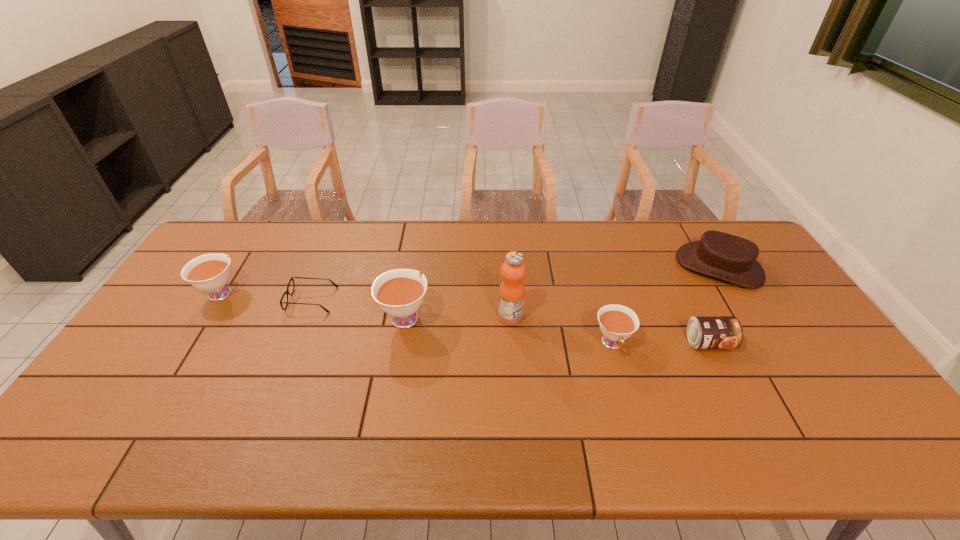
Where is `can`? The height and width of the screenshot is (540, 960). can is located at coordinates (704, 332).

The image size is (960, 540). Find the location of `free space located 0.180m on the side of the leftmost teacup with the handle`. free space located 0.180m on the side of the leftmost teacup with the handle is located at coordinates (252, 242).

I want to click on free location located on the side of the leftmost teacup with the handle, so click(x=261, y=227).

Identify the location of free location located on the side of the leftmost teacup with the handle. This screenshot has height=540, width=960. (255, 237).

Find the location of a particular element. This screenshot has width=960, height=540. free region located 0.260m on the side of the second teacup from left to right with the handle is located at coordinates (418, 245).

You are a GUI agent. You are given a task and a screenshot of the screen. Output one action in this format:
    pyautogui.click(x=<x>, y=<y>)
    Task: Click on the vacant space located 0.180m on the side of the second teacup from left to right with the handle
    The height and width of the screenshot is (540, 960).
    Given the screenshot: What is the action you would take?
    415,259

In order to click on vacant space located 0.210m on the side of the second teacup from left to right with the handle in this screenshot , I will do `click(416, 253)`.

In order to click on vacant space located on the side of the rightmost teacup with the handle in this screenshot , I will do pyautogui.click(x=633, y=415).

The width and height of the screenshot is (960, 540). In order to click on vacant position located 0.240m on the left of the hat in this screenshot , I will do `click(607, 267)`.

Where is `vacant space located 0.160m on the front of the tallest object`? vacant space located 0.160m on the front of the tallest object is located at coordinates (515, 372).